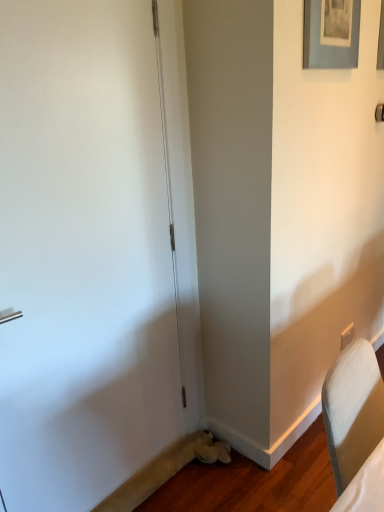
Question: Is matte gray picture frame at upper right wider or thinner than beige plastic electric outlet at lower right?

Choices:
 (A) thin
 (B) wide

Answer: (B)

Question: In terms of size, does matte gray picture frame at upper right appear bigger or smaller than beige plastic electric outlet at lower right?

Choices:
 (A) big
 (B) small

Answer: (A)

Question: Which is farther from the matte gray picture frame at upper right?

Choices:
 (A) white matte door at left
 (B) beige plastic electric outlet at lower right

Answer: (B)

Question: Which object is the farthest from the matte gray picture frame at upper right?

Choices:
 (A) white matte door at left
 (B) beige plastic electric outlet at lower right

Answer: (B)